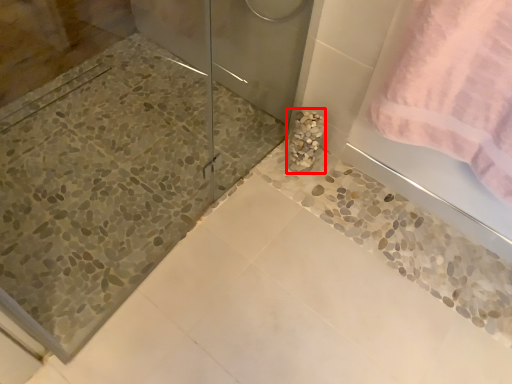
Question: In this image, where is marble (annotated by the red box) located relative to towel?

Choices:
 (A) left
 (B) right

Answer: (A)